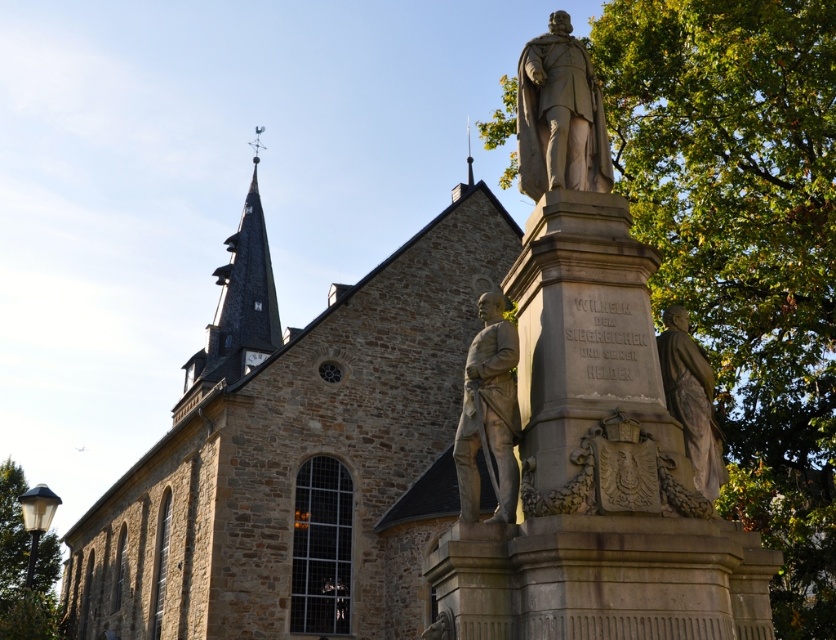
Is point (232, 346) positioned before point (669, 387)?

No.

Is point (253, 275) positioned before point (701, 432)?

No, it is behind (701, 432).

Where is `dark gray stone clock tower at upper left`? dark gray stone clock tower at upper left is located at coordinates (238, 305).

This screenshot has width=836, height=640. Describe the element at coordinates (559, 115) in the screenshot. I see `stone statue at upper right` at that location.

The width and height of the screenshot is (836, 640). I want to click on stone statue at upper right, so click(x=559, y=115).

Can you confirm if green leafy tree at right is wider than dark gray stone clock tower at upper left?

No, green leafy tree at right is not wider than dark gray stone clock tower at upper left.

Which is more to the left, green leafy tree at right or dark gray stone clock tower at upper left?

From the viewer's perspective, dark gray stone clock tower at upper left appears more on the left side.

You are a GUI agent. You are given a task and a screenshot of the screen. Output one action in this format:
    pyautogui.click(x=<x>, y=<y>)
    Task: Click on the green leafy tree at right
    The height and width of the screenshot is (640, 836).
    Given the screenshot: What is the action you would take?
    pyautogui.click(x=743, y=244)